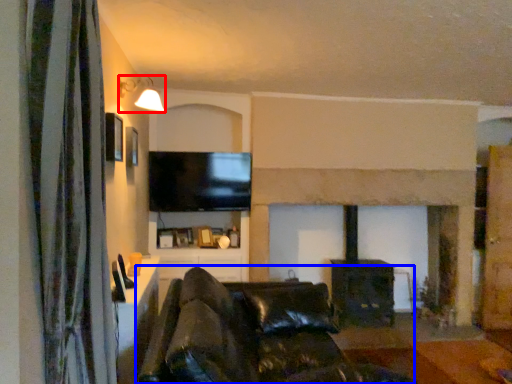
Question: Which of the following is the farthest to the observer, light fixture (highlighted by a red box) or studio couch (highlighted by a blue box)?

Choices:
 (A) light fixture
 (B) studio couch

Answer: (A)